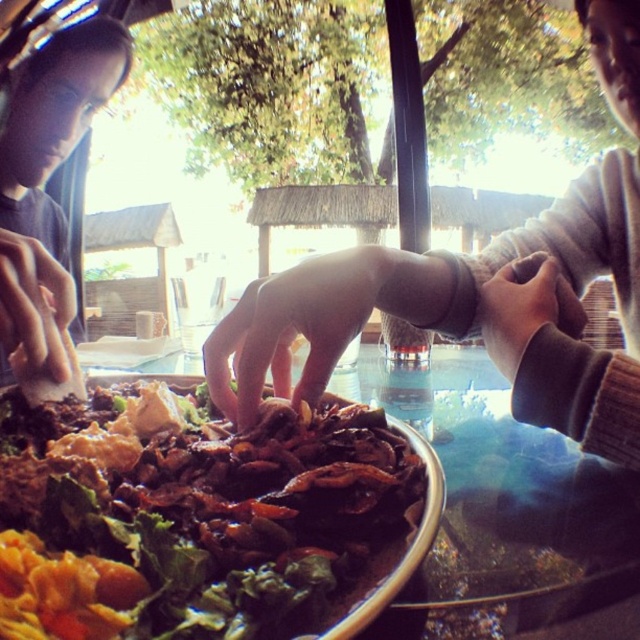
You are a server at the restaurant and need to place a hot dish on the table. There are two hands, the smooth beige hand at center and the pink matte hand at center, on the table. Which hand should you avoid placing the dish on top of to ensure it doesn t get burned?

You should avoid placing the dish on top of the smooth beige hand at center because it is in front of the pink matte hand at center, meaning it is closer to the dish and more likely to be burned.

You are a server at the outdoor restaurant and need to place a 6 inch long utensil between the pink matte hand at center and the brown fuzzy sweater at upper right. Can you fit it there?

The distance between the pink matte hand at center and the brown fuzzy sweater at upper right is 5.13 inches, so the 6 inch utensil cannot fit between them as it is longer than the available space.